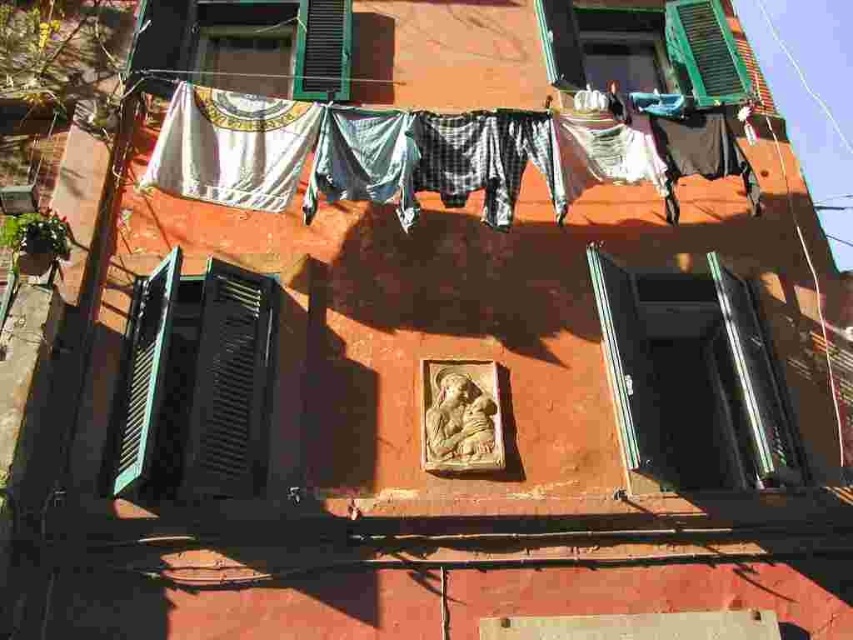
You are standing in front of the building and notice the green matte window at left and the green matte shutter at upper right. Which of these two objects is positioned higher up on the building?

The green matte shutter at upper right is positioned higher up on the building than the green matte window at left.

You are standing 20 feet away from the building facade. A point labeled as point (318, 179) is marked on the wall. Can you reach this point with a 10 foot long pole?

The distance of point (318, 179) from viewer is 21.23 feet. Since you are standing 20 feet away, the total distance to the point is 20 feet plus 21.23 feet, which is 41.23 feet. A 10 foot long pole is insufficient to reach that distance.

You are standing in front of the building and want to hang a new piece of fabric that is exactly the same size and shape as the white fabric at upper center. Where should you place it to match the existing position?

Place the new fabric at the coordinates point [421,154] to match the existing position of the white fabric at upper center.